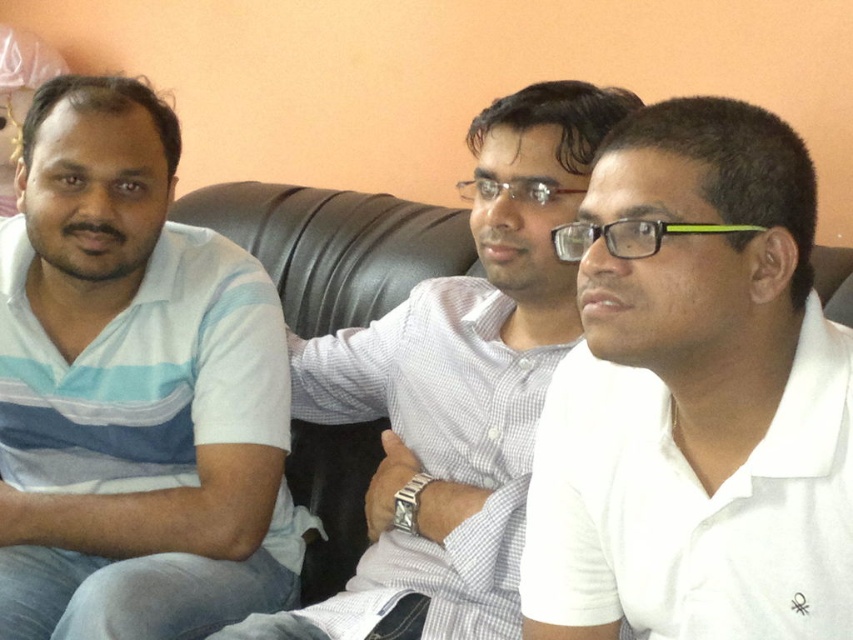
Who is lower down, blue striped polo shirt at left or black leather couch at center?

blue striped polo shirt at left

Is point (163, 314) positioned in front of point (378, 292)?

Yes, it is in front of point (378, 292).

Who is more distant from viewer, (91,412) or (412,234)?

Point (412,234)

Find the location of `blue striped polo shirt at left`. blue striped polo shirt at left is located at coordinates (132, 390).

Between blue striped polo shirt at left and white checkered shirt at center, which one is positioned higher?

white checkered shirt at center is above.

Who is more distant from viewer, (x=74, y=288) or (x=466, y=388)?

Positioned behind is point (x=74, y=288).

Is point (222, 241) behind point (508, 326)?

Yes, point (222, 241) is farther from viewer.

What are the coordinates of `blue striped polo shirt at left` in the screenshot? It's located at (132, 390).

Who is more distant from viewer, (x=583, y=384) or (x=347, y=525)?

The point (x=347, y=525) is more distant.

Who is positioned more to the right, white matte shirt at center or black leather couch at center?

white matte shirt at center

Describe the element at coordinates (694, 397) in the screenshot. I see `white matte shirt at center` at that location.

At what (x,y) coordinates should I click in order to perform the action: click on white matte shirt at center. Please return your answer as a coordinate pair (x, y). The image size is (853, 640). Looking at the image, I should click on (694, 397).